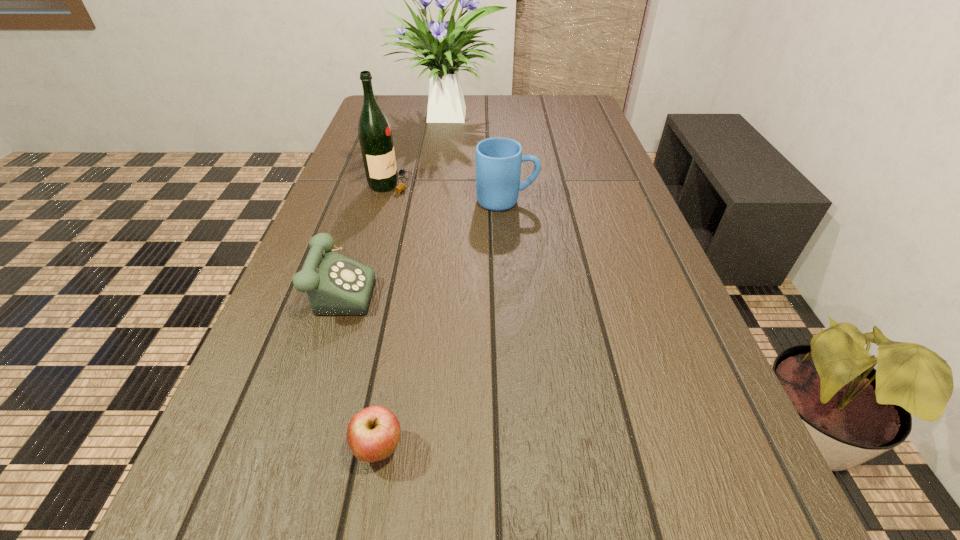
The height and width of the screenshot is (540, 960). In order to click on free spot between the shortest object and the second nearest object in this screenshot , I will do `click(359, 366)`.

Find the location of `free point between the third tallest object and the second nearest object`. free point between the third tallest object and the second nearest object is located at coordinates (422, 242).

Where is `the third closest object to the telephone`? the third closest object to the telephone is located at coordinates coord(498,160).

At what (x,y) coordinates should I click in order to perform the action: click on object that is the fourth closest to the mug. Please return your answer as a coordinate pair (x, y). Looking at the image, I should click on (373, 433).

Where is `vacant space that satisfies the following two spatial constraints: 1. on the surface of the fourth shortest object; 2. on the left side of the apple`? vacant space that satisfies the following two spatial constraints: 1. on the surface of the fourth shortest object; 2. on the left side of the apple is located at coordinates (317, 449).

Where is `vacant region that satisfies the following two spatial constraints: 1. on the surface of the fourth shortest object; 2. on the right side of the apple`? This screenshot has height=540, width=960. vacant region that satisfies the following two spatial constraints: 1. on the surface of the fourth shortest object; 2. on the right side of the apple is located at coordinates (317, 449).